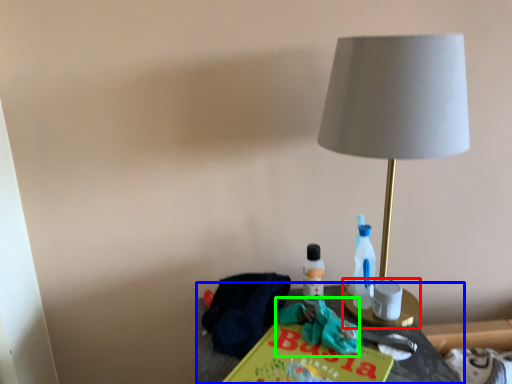
Question: Which is farther away from candle holder (highlighted by a red box)? table (highlighted by a blue box) or scrub (highlighted by a green box)?

Choices:
 (A) table
 (B) scrub

Answer: (B)